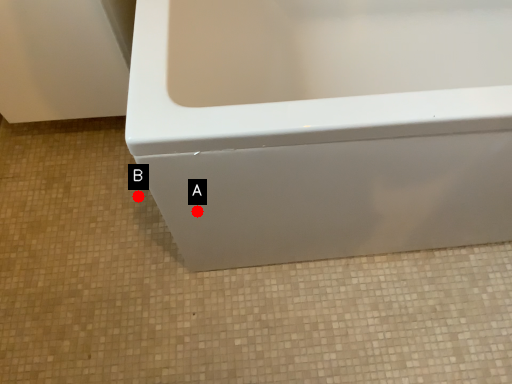
Question: Two points are circled on the image, labeled by A and B beside each circle. Which point is further to the camera?

Choices:
 (A) A is further
 (B) B is further

Answer: (B)